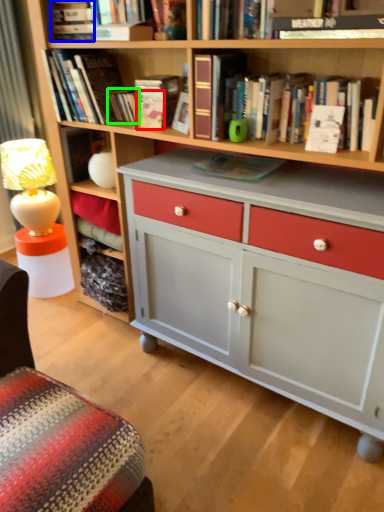
Question: Which object is the farthest from paperback book (highlighted by a red box)? Choose among these: book (highlighted by a blue box) or paperback book (highlighted by a green box).

Choices:
 (A) book
 (B) paperback book

Answer: (A)